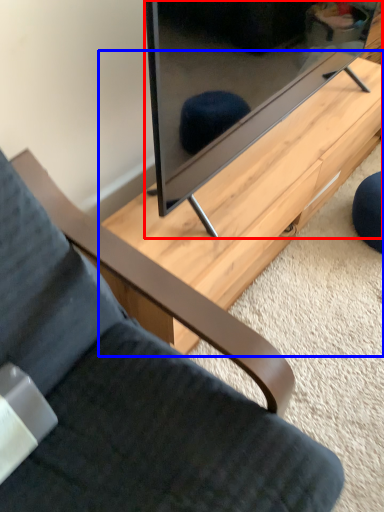
Question: Which object is further to the camera taking this photo, television (highlighted by a red box) or table (highlighted by a blue box)?

Choices:
 (A) television
 (B) table

Answer: (B)